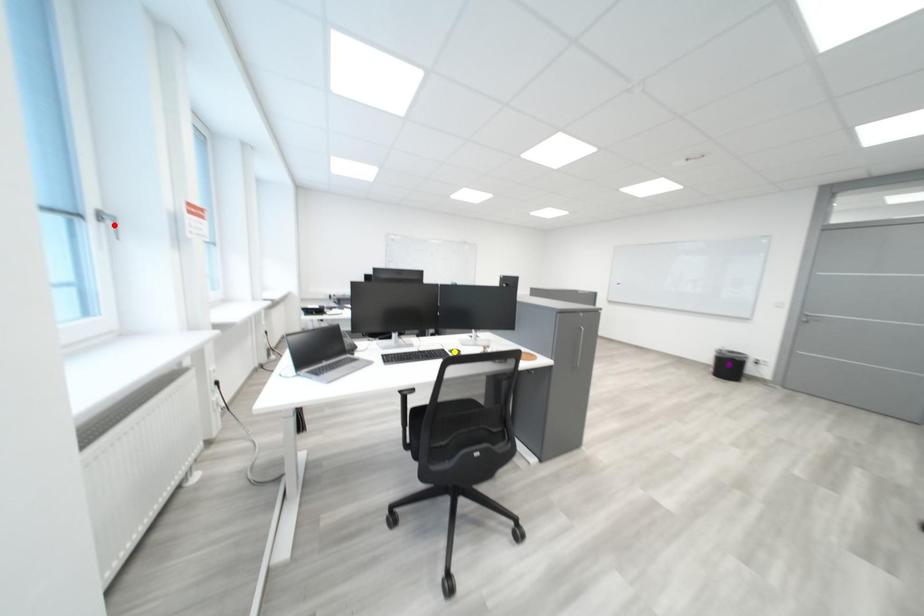
Order these from farthest to nearest:
- purple point
- yellow point
- red point

purple point < yellow point < red point